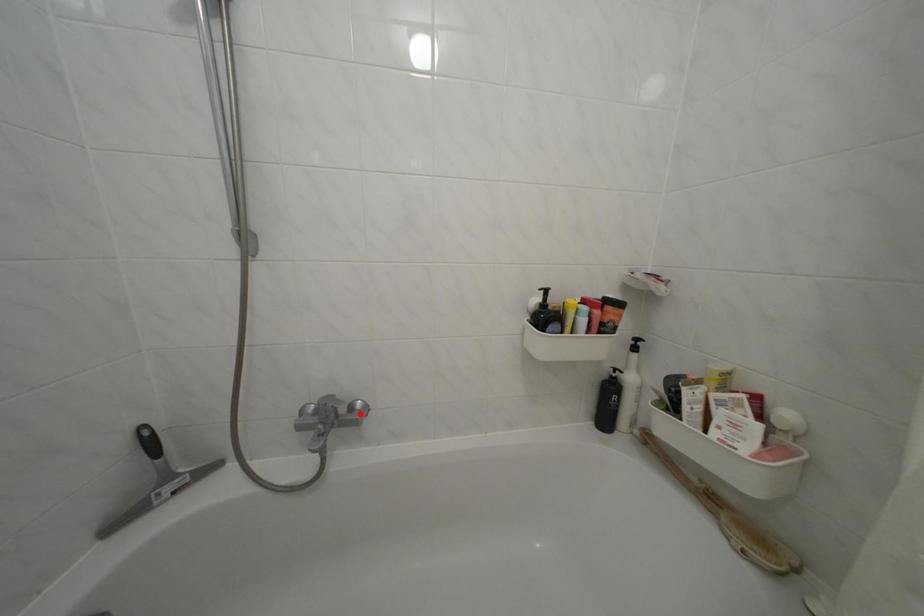
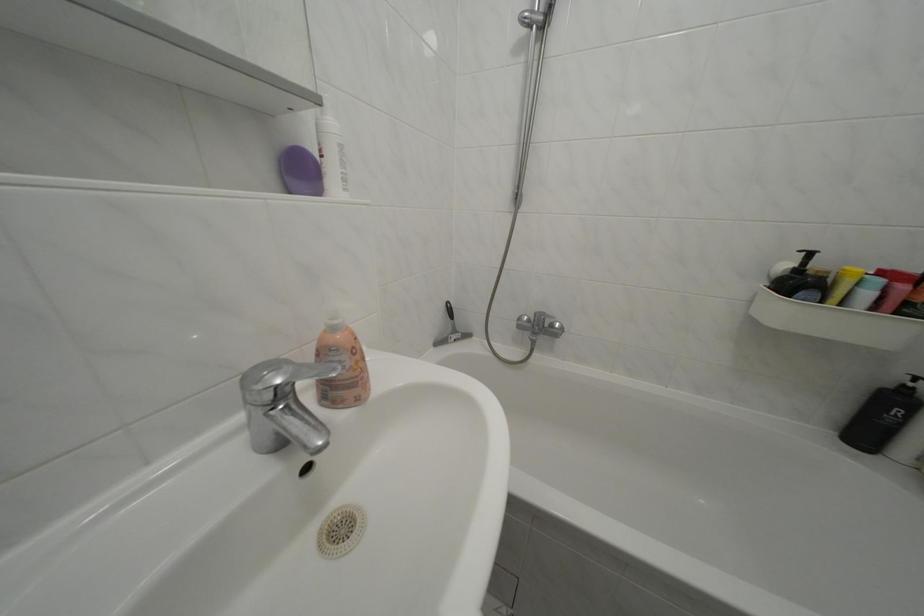
The point at the highlighted location is marked in the first image. Where is the corresponding point in the second image?

(562, 331)